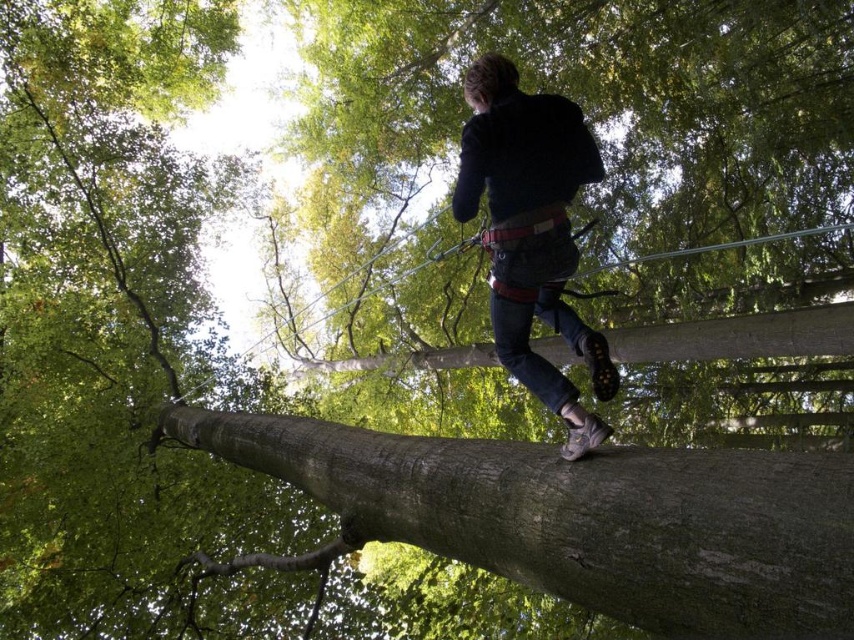
You are a safety inspector assessing the climbing setup. You notice the brown rough tree trunk at center and the dark blue jeans at center. Based on their positions, which object is more to the left?

The brown rough tree trunk at center is positioned on the left side of dark blue jeans at center, so it is more to the left.

You are a safety inspector assessing the climbing setup. The brown rough tree trunk at center is supposed to support the weight of the climber wearing dark blue jeans at center. Based on their heights, is the tree trunk sufficient to safely anchor the ropes for the climber?

The brown rough tree trunk at center has a lesser height compared to dark blue jeans at center, which implies the trunk is shorter than the climber. This could mean the trunk may not provide adequate height for secure anchoring points, potentially compromising safety. A taller trunk would be safer for proper rope setup.

You are a safety inspector checking the climbing setup. The brown rough tree trunk at center is the main support for the climber wearing dark blue jeans at center. Based on the image, is the tree trunk wide enough to safely secure the climber?

The brown rough tree trunk at center is wider than the dark blue jeans at center, so it is wide enough to safely secure the climber.